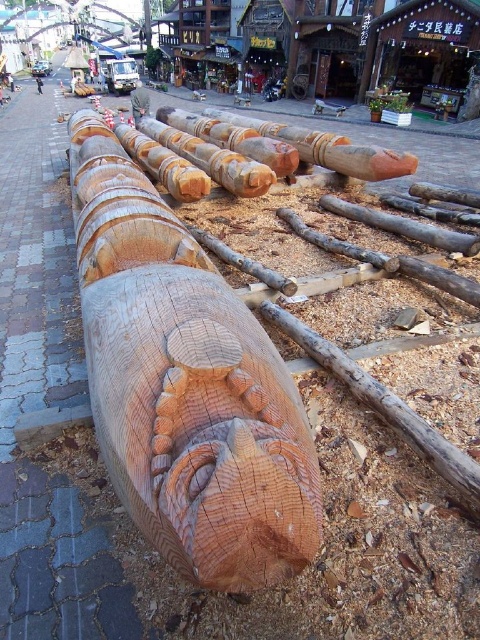
Can you confirm if natural wood carving at center is smaller than smooth brown tree trunk at center?

No.

Which of these two, natural wood carving at center or smooth brown tree trunk at center, stands shorter?

Standing shorter between the two is smooth brown tree trunk at center.

Is point (71, 118) farther from viewer compared to point (149, 51)?

No, (71, 118) is in front of (149, 51).

This screenshot has height=640, width=480. Find the location of `natural wood carving at center`. natural wood carving at center is located at coordinates (186, 385).